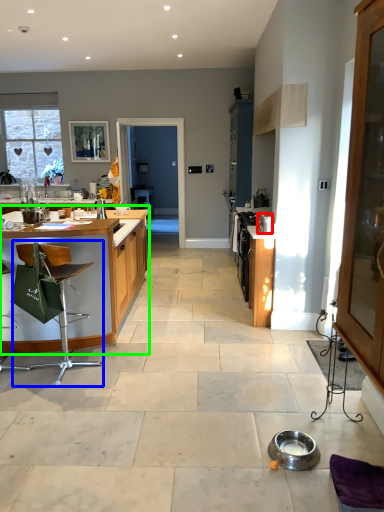
Question: Which object is the closest to the appliance (highlighted by a red box)? Choose among these: chair (highlighted by a blue box) or table (highlighted by a green box).

Choices:
 (A) chair
 (B) table

Answer: (B)